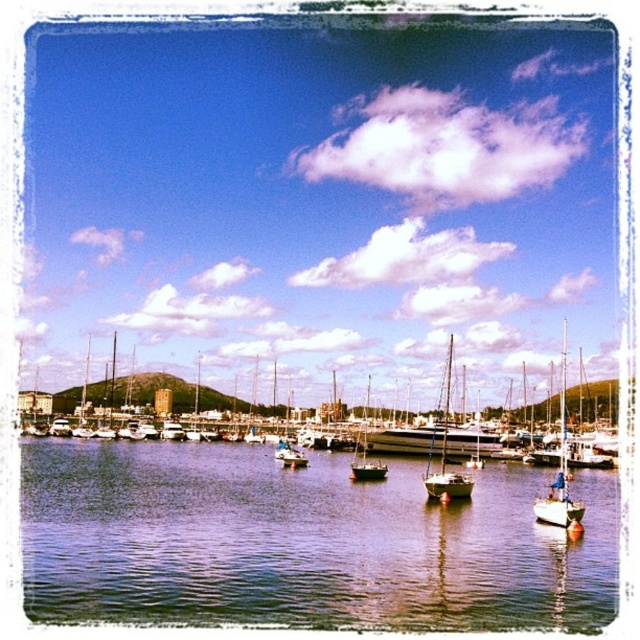
Question: Does white matte sailboat at right appear over white matte sailboat at center?

Choices:
 (A) yes
 (B) no

Answer: (B)

Question: Does shiny dark water at center have a smaller size compared to smooth white sailboat at center?

Choices:
 (A) no
 (B) yes

Answer: (A)

Question: Which of the following is the closest to the observer?

Choices:
 (A) smooth white sailboat at center
 (B) white matte sailboat at center

Answer: (B)

Question: Estimate the real-world distances between objects in this image. Which object is farther from the white matte sailboat at center?

Choices:
 (A) smooth white sailboat at center
 (B) white matte sailboat at right
 (C) shiny dark water at center

Answer: (B)

Question: Which point appears closest to the camera in this image?

Choices:
 (A) (554, 524)
 (B) (384, 465)
 (C) (452, 348)
 (D) (188, 618)

Answer: (D)

Question: Can you confirm if shiny dark water at center is thinner than white matte sailboat at center?

Choices:
 (A) yes
 (B) no

Answer: (B)